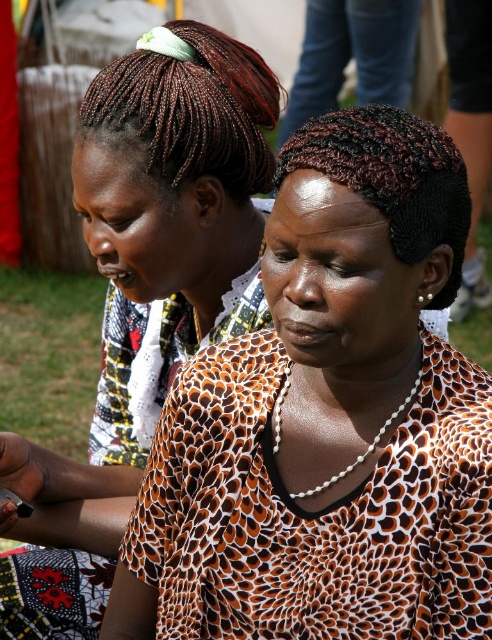
You are a tailor measuring two items in the image. The printed fabric blouse at center and the braided dark brown hair at upper left. Which item is wider?

The printed fabric blouse at center is wider than the braided dark brown hair at upper left because its width surpasses the hair.